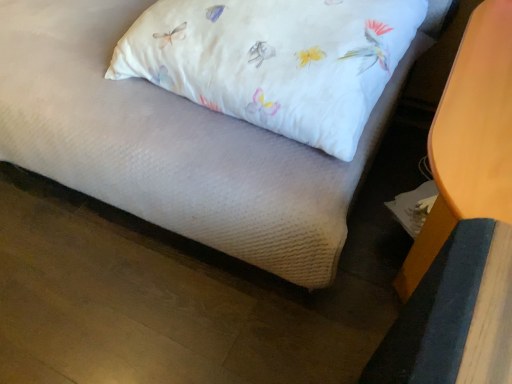
Question: From the image's perspective, relative to white fabric pillow at upper center, is matte wood table at lower right above or below?

Choices:
 (A) below
 (B) above

Answer: (A)

Question: From a real-world perspective, relative to white fabric pillow at upper center, is matte wood table at lower right vertically above or below?

Choices:
 (A) below
 (B) above

Answer: (A)

Question: Looking at the image, does matte wood table at lower right seem bigger or smaller compared to white fabric pillow at upper center?

Choices:
 (A) small
 (B) big

Answer: (B)

Question: Based on their sizes in the image, would you say white fabric pillow at upper center is bigger or smaller than matte wood table at lower right?

Choices:
 (A) big
 (B) small

Answer: (B)

Question: Is white fabric pillow at upper center taller or shorter than matte wood table at lower right?

Choices:
 (A) short
 (B) tall

Answer: (A)

Question: Is white fabric pillow at upper center inside or outside of matte wood table at lower right?

Choices:
 (A) outside
 (B) inside

Answer: (A)

Question: From the image's perspective, relative to matte wood table at lower right, is white fabric pillow at upper center above or below?

Choices:
 (A) below
 (B) above

Answer: (B)